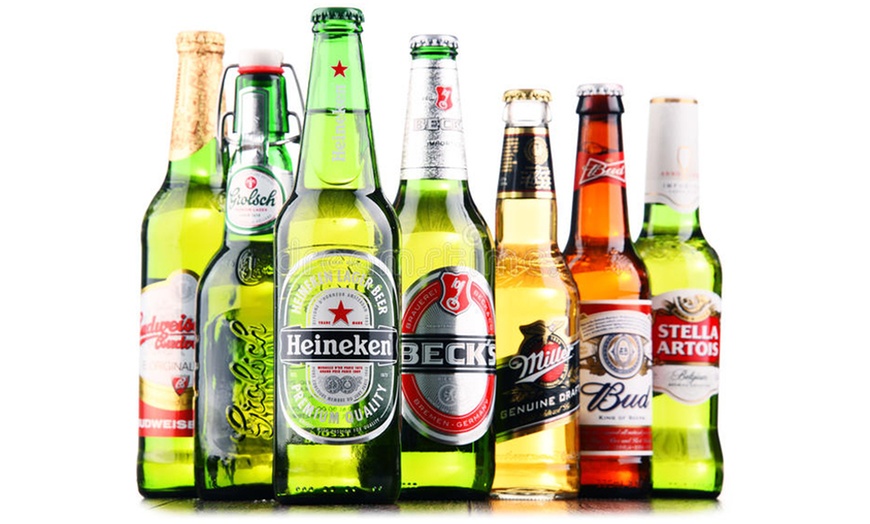
At what (x,y) coordinates should I click in order to perform the action: click on glass bottles. Please return your answer as a coordinate pair (x, y). The height and width of the screenshot is (524, 870). Looking at the image, I should click on coord(184,174), coord(244,189), coord(346,140), coord(425,162), coord(526,161), coord(598,171), coord(666,169).